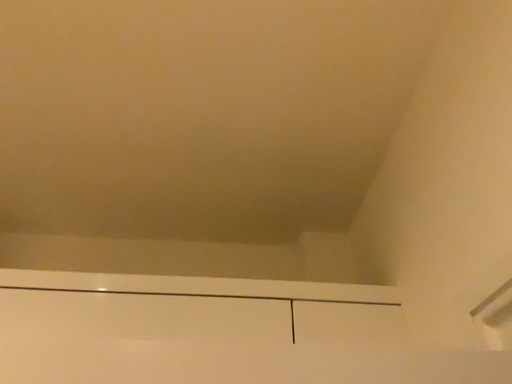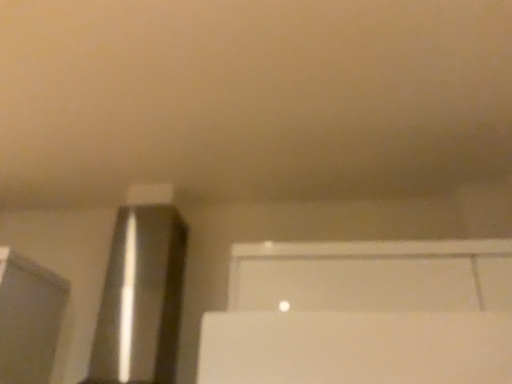
Question: Which way did the camera rotate in the video?

Choices:
 (A) rotated upward
 (B) rotated downward

Answer: (B)